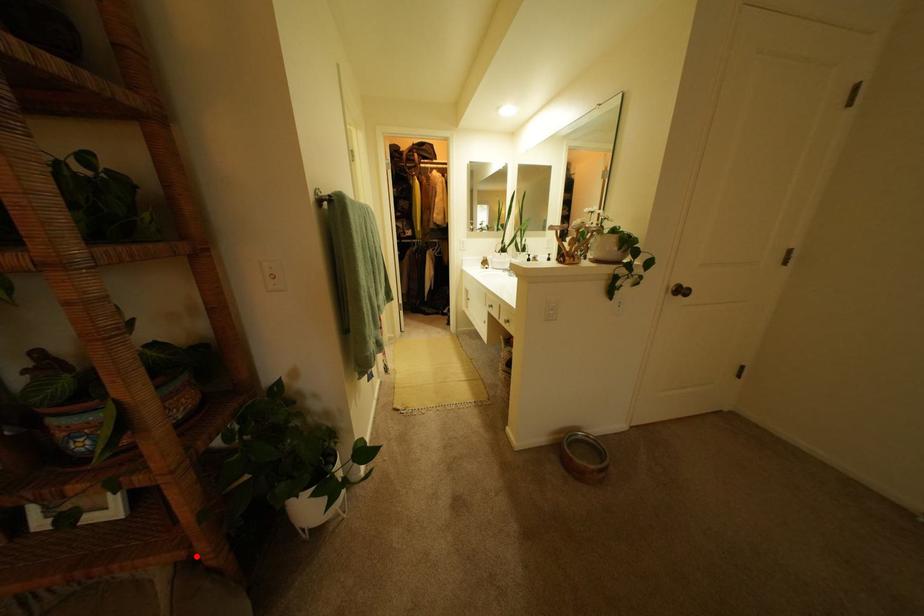
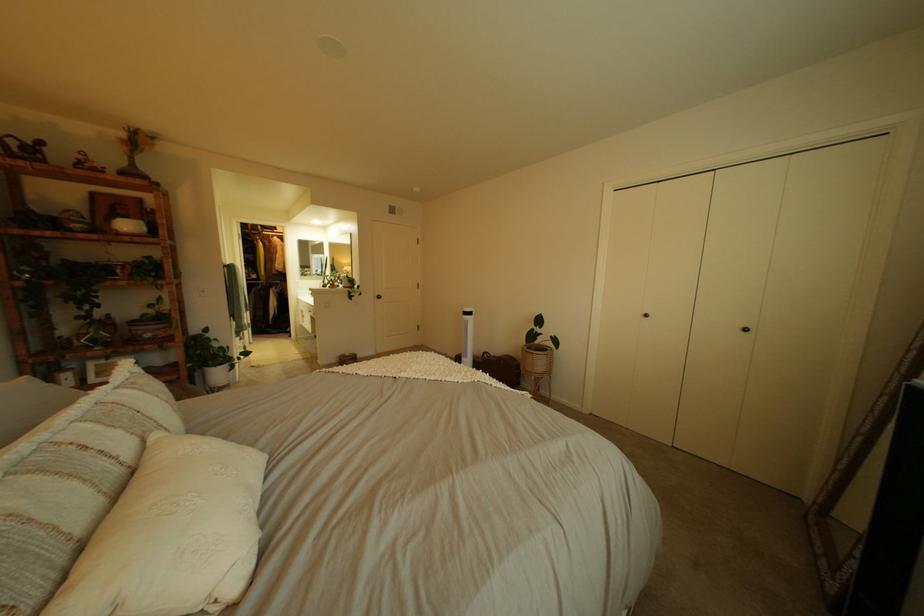
Question: I am providing you with two images of the same scene from different viewpoints. Image1 has a red point marked. In image2, the corresponding 3D location appears at what relative position? Reply with the corresponding letter.

Choices:
 (A) Closer
 (B) Farther

Answer: (A)